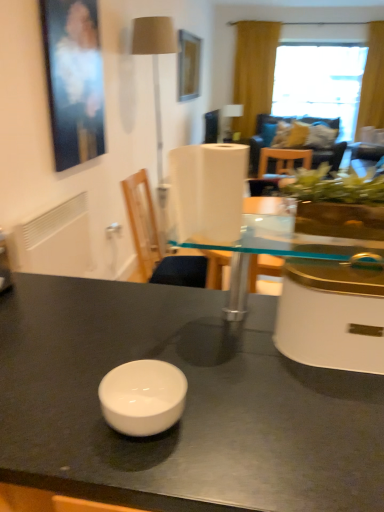
Where is `vacant space in front of white glossy bowl at center`? This screenshot has height=512, width=384. vacant space in front of white glossy bowl at center is located at coordinates (151, 475).